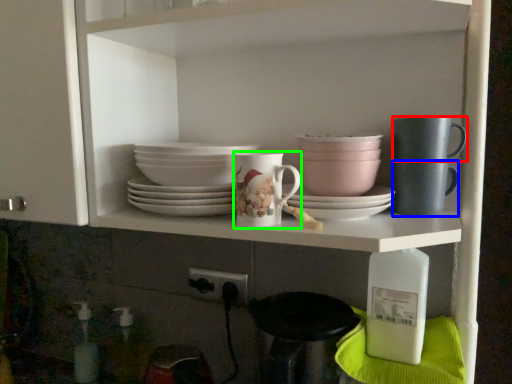
Question: Which is nearer to the tableware (highlighted by a red box)? mug (highlighted by a blue box) or coffee cup (highlighted by a green box).

Choices:
 (A) mug
 (B) coffee cup

Answer: (A)